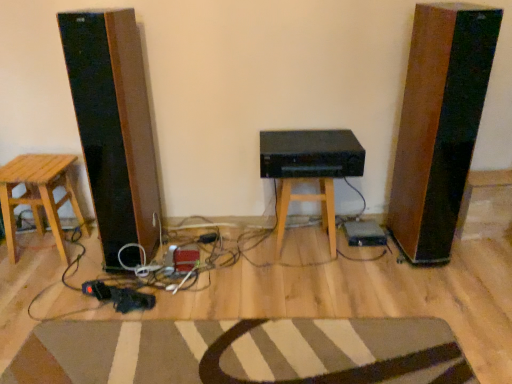
Question: Can you confirm if wooden stool at center, which is the first stool in right-to-left order, is bigger than striped wool doormat at lower center?

Choices:
 (A) no
 (B) yes

Answer: (B)

Question: Would you say wooden stool at center, the second stool when ordered from left to right, is outside striped wool doormat at lower center?

Choices:
 (A) no
 (B) yes

Answer: (B)

Question: Is wooden stool at center, the second stool when ordered from left to right, positioned in front of striped wool doormat at lower center?

Choices:
 (A) yes
 (B) no

Answer: (B)

Question: Considering the relative positions of wooden stool at center, which is the first stool in right-to-left order, and striped wool doormat at lower center in the image provided, is wooden stool at center, which is the first stool in right-to-left order, to the left of striped wool doormat at lower center from the viewer's perspective?

Choices:
 (A) no
 (B) yes

Answer: (A)

Question: Is striped wool doormat at lower center a part of wooden stool at center, the second stool when ordered from left to right?

Choices:
 (A) no
 (B) yes

Answer: (A)

Question: Considering the positions of wooden stool at center, the second stool when ordered from left to right, and wooden stool at left, arranged as the 1th stool when viewed from the left, in the image, is wooden stool at center, the second stool when ordered from left to right, taller or shorter than wooden stool at left, arranged as the 1th stool when viewed from the left,?

Choices:
 (A) tall
 (B) short

Answer: (B)

Question: Is wooden stool at center, which is the first stool in right-to-left order, wider or thinner than wooden stool at left, arranged as the 1th stool when viewed from the left?

Choices:
 (A) thin
 (B) wide

Answer: (A)

Question: From the image's perspective, is wooden stool at center, which is the first stool in right-to-left order, located above or below wooden stool at left, acting as the second stool starting from the right?

Choices:
 (A) above
 (B) below

Answer: (A)

Question: Visually, is wooden stool at center, which is the first stool in right-to-left order, positioned to the left or to the right of wooden stool at left, arranged as the 1th stool when viewed from the left?

Choices:
 (A) right
 (B) left

Answer: (A)

Question: From the image's perspective, is black matte speaker at center above or below wooden stool at left, arranged as the 1th stool when viewed from the left?

Choices:
 (A) below
 (B) above

Answer: (B)

Question: In the image, is black matte speaker at center on the left side or the right side of wooden stool at left, acting as the second stool starting from the right?

Choices:
 (A) left
 (B) right

Answer: (B)

Question: Is black matte speaker at center spatially inside wooden stool at left, arranged as the 1th stool when viewed from the left, or outside of it?

Choices:
 (A) outside
 (B) inside

Answer: (A)

Question: Considering the positions of black matte speaker at center and wooden stool at left, arranged as the 1th stool when viewed from the left, in the image, is black matte speaker at center taller or shorter than wooden stool at left, arranged as the 1th stool when viewed from the left,?

Choices:
 (A) short
 (B) tall

Answer: (A)

Question: Considering the relative positions of black matte speaker at center and striped wool doormat at lower center in the image provided, is black matte speaker at center to the left or to the right of striped wool doormat at lower center?

Choices:
 (A) left
 (B) right

Answer: (B)

Question: From a real-world perspective, is black matte speaker at center physically located above or below striped wool doormat at lower center?

Choices:
 (A) below
 (B) above

Answer: (B)